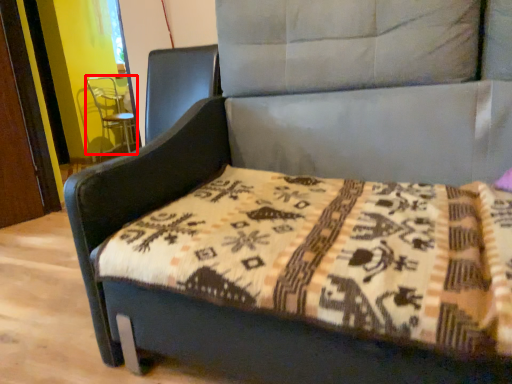
Question: From the image, what is the correct spatial relationship of swivel chair (annotated by the red box) in relation to mattress?

Choices:
 (A) left
 (B) right

Answer: (A)